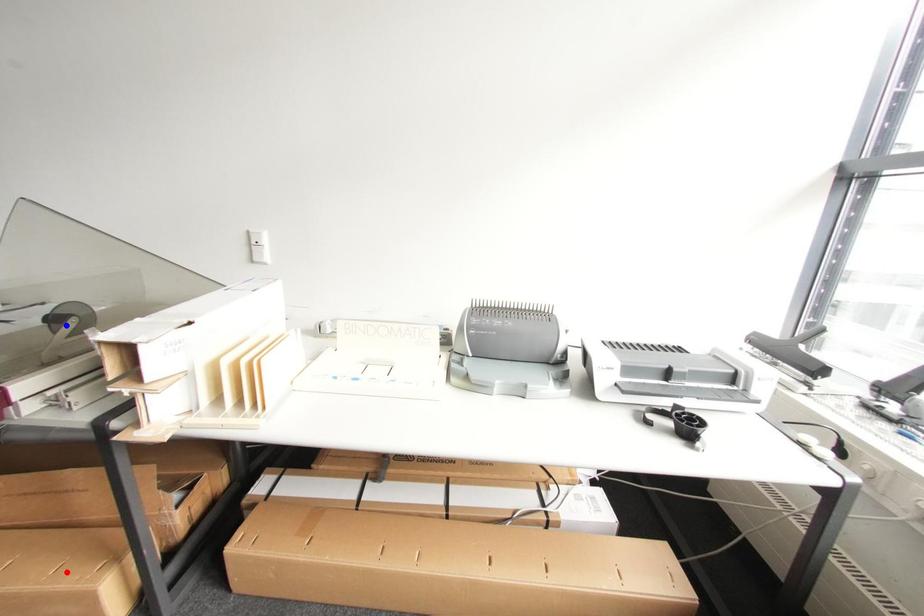
Question: In the image, two points are highlighted. Which point is nearer to the camera? Reply with the corresponding letter.

Choices:
 (A) blue point
 (B) red point

Answer: (B)